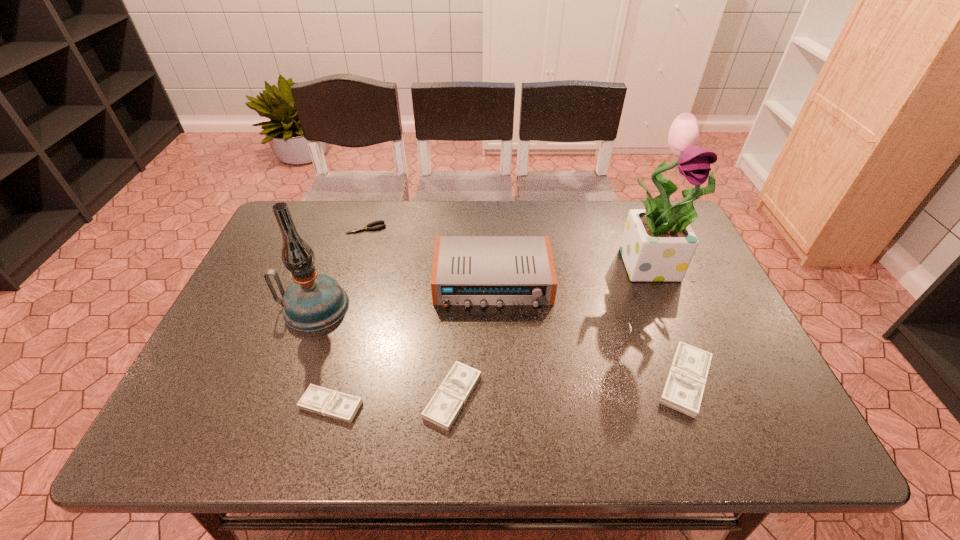
I want to click on money present at the right edge, so click(x=683, y=390).

This screenshot has height=540, width=960. Find the location of `flower arrangement at the right edge`. flower arrangement at the right edge is located at coordinates (658, 244).

At what (x,y) coordinates should I click in order to perform the action: click on object located at the far right corner. Please return your answer as a coordinate pair (x, y). The image size is (960, 540). Looking at the image, I should click on (658, 244).

At what (x,y) coordinates should I click in order to perform the action: click on object that is positioned at the near right corner. Please return your answer as a coordinate pair (x, y). The height and width of the screenshot is (540, 960). Looking at the image, I should click on (683, 390).

In the image, there is a desktop. Find the location of `vacant space at the far edge`. vacant space at the far edge is located at coordinates (458, 207).

In the image, there is a desktop. Where is `vacant space at the near edge`? The height and width of the screenshot is (540, 960). vacant space at the near edge is located at coordinates (305, 381).

The width and height of the screenshot is (960, 540). I want to click on free space at the left edge, so click(x=252, y=359).

Locate an element on the screen. This screenshot has width=960, height=540. vacant space at the right edge of the desktop is located at coordinates (729, 312).

Image resolution: width=960 pixels, height=540 pixels. I want to click on vacant region at the near right corner of the desktop, so click(768, 400).

Locate an element on the screen. vacant region between the fifth shortest object and the second shortest object is located at coordinates (412, 343).